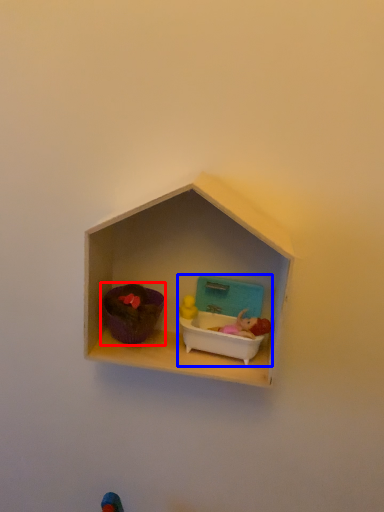
Question: Which point is further to the camera, toy (highlighted by a red box) or toy (highlighted by a blue box)?

Choices:
 (A) toy
 (B) toy

Answer: (B)